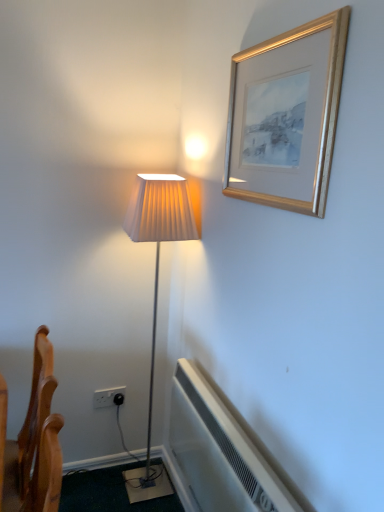
Question: Would you say wooden chair at lower left is outside gold metallic picture frame at upper right?

Choices:
 (A) no
 (B) yes

Answer: (B)

Question: From the image's perspective, does wooden chair at lower left appear lower than gold metallic picture frame at upper right?

Choices:
 (A) yes
 (B) no

Answer: (A)

Question: Considering the relative positions of wooden chair at lower left and gold metallic picture frame at upper right in the image provided, is wooden chair at lower left behind gold metallic picture frame at upper right?

Choices:
 (A) no
 (B) yes

Answer: (B)

Question: From the image's perspective, is wooden chair at lower left located above gold metallic picture frame at upper right?

Choices:
 (A) yes
 (B) no

Answer: (B)

Question: Is wooden chair at lower left next to gold metallic picture frame at upper right and touching it?

Choices:
 (A) yes
 (B) no

Answer: (B)

Question: Is wooden chair at lower left at the left side of gold metallic picture frame at upper right?

Choices:
 (A) yes
 (B) no

Answer: (A)

Question: Is gold metallic picture frame at upper right positioned far away from wooden chair at lower left?

Choices:
 (A) yes
 (B) no

Answer: (B)

Question: Does gold metallic picture frame at upper right turn towards wooden chair at lower left?

Choices:
 (A) yes
 (B) no

Answer: (B)

Question: From a real-world perspective, is gold metallic picture frame at upper right located higher than wooden chair at lower left?

Choices:
 (A) yes
 (B) no

Answer: (A)

Question: Is gold metallic picture frame at upper right taller than wooden chair at lower left?

Choices:
 (A) no
 (B) yes

Answer: (A)

Question: Is gold metallic picture frame at upper right wider than wooden chair at lower left?

Choices:
 (A) no
 (B) yes

Answer: (A)

Question: From a real-world perspective, is gold metallic picture frame at upper right under wooden chair at lower left?

Choices:
 (A) no
 (B) yes

Answer: (A)

Question: From the image's perspective, is white plastic electric outlet at lower left below white plastic air conditioner at lower center?

Choices:
 (A) no
 (B) yes

Answer: (A)